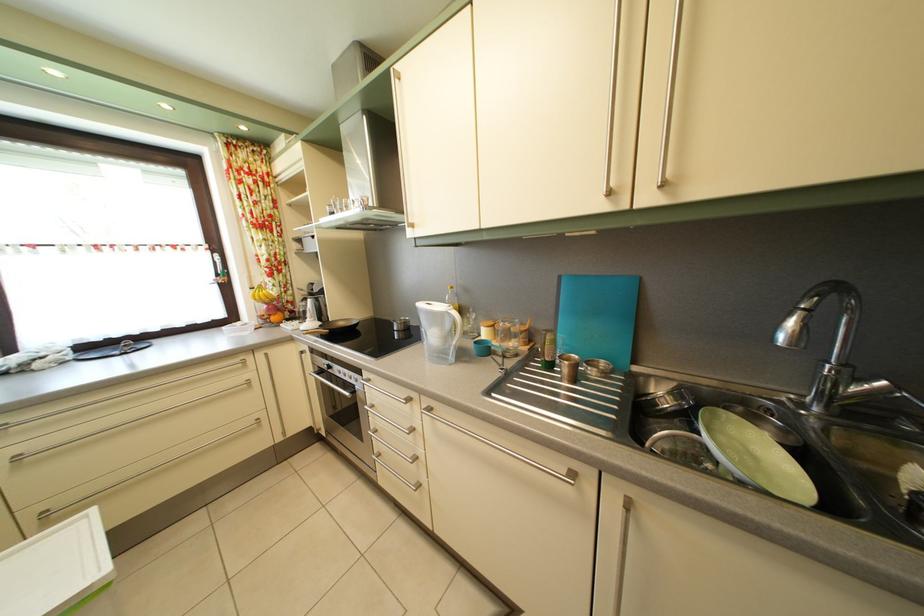
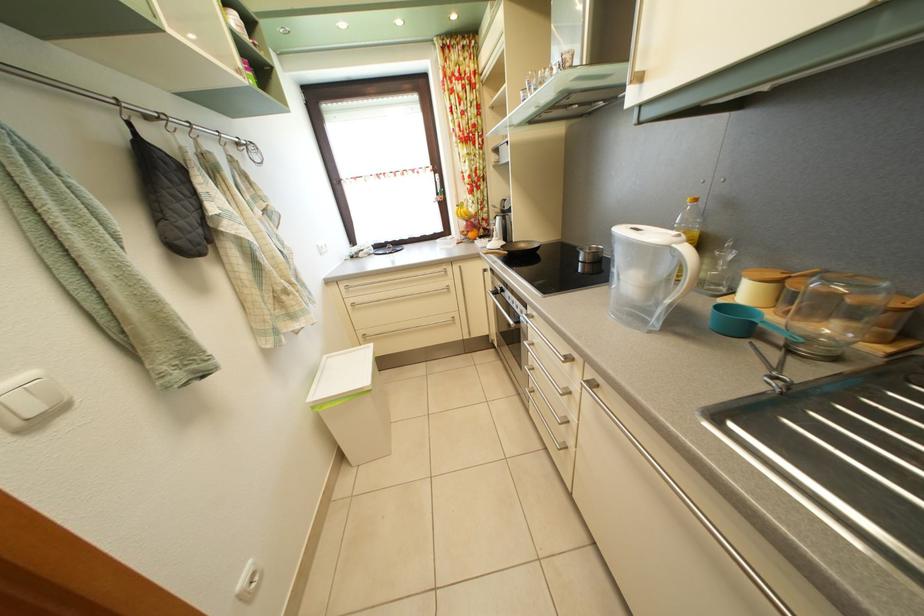
Based on the continuous images, in which direction is the camera rotating?

The camera's rotation is toward left-down.